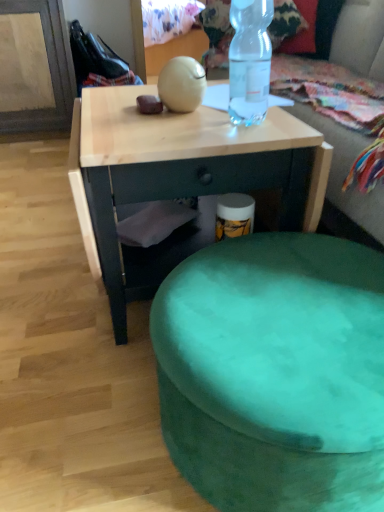
Question: Is green fabric bean bag at upper center thinner than velvet green ottoman at lower center?

Choices:
 (A) no
 (B) yes

Answer: (A)

Question: Does green fabric bean bag at upper center appear on the right side of velvet green ottoman at lower center?

Choices:
 (A) no
 (B) yes

Answer: (B)

Question: From the image's perspective, is green fabric bean bag at upper center located beneath velvet green ottoman at lower center?

Choices:
 (A) yes
 (B) no

Answer: (B)

Question: Does green fabric bean bag at upper center have a greater width compared to velvet green ottoman at lower center?

Choices:
 (A) yes
 (B) no

Answer: (A)

Question: Does green fabric bean bag at upper center lie in front of velvet green ottoman at lower center?

Choices:
 (A) yes
 (B) no

Answer: (B)

Question: Is green fabric bean bag at upper center facing towards velvet green ottoman at lower center?

Choices:
 (A) no
 (B) yes

Answer: (A)

Question: Can you confirm if transparent plastic bottle at upper center is taller than velvet green ottoman at lower center?

Choices:
 (A) yes
 (B) no

Answer: (A)

Question: From a real-world perspective, is transparent plastic bottle at upper center positioned under velvet green ottoman at lower center based on gravity?

Choices:
 (A) yes
 (B) no

Answer: (B)

Question: Is transparent plastic bottle at upper center thinner than velvet green ottoman at lower center?

Choices:
 (A) no
 (B) yes

Answer: (B)

Question: Is transparent plastic bottle at upper center directly adjacent to velvet green ottoman at lower center?

Choices:
 (A) yes
 (B) no

Answer: (B)

Question: Is transparent plastic bottle at upper center at the right side of velvet green ottoman at lower center?

Choices:
 (A) yes
 (B) no

Answer: (B)

Question: Are transparent plastic bottle at upper center and velvet green ottoman at lower center located far from each other?

Choices:
 (A) no
 (B) yes

Answer: (A)

Question: Is natural wood desk at center positioned behind transparent plastic bottle at upper center?

Choices:
 (A) yes
 (B) no

Answer: (A)